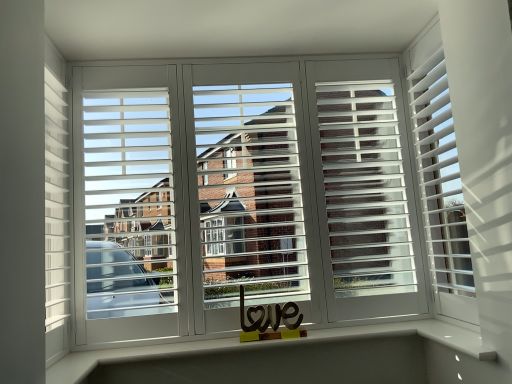
In order to click on white matte blinds at right in this screenshot , I will do `click(441, 188)`.

This screenshot has width=512, height=384. Describe the element at coordinates (441, 188) in the screenshot. I see `white matte blinds at right` at that location.

What is the approximate width of white matte blinds at right?

white matte blinds at right is 4.07 inches in width.

Where is `white matte blinds at right`? This screenshot has height=384, width=512. white matte blinds at right is located at coordinates [441, 188].